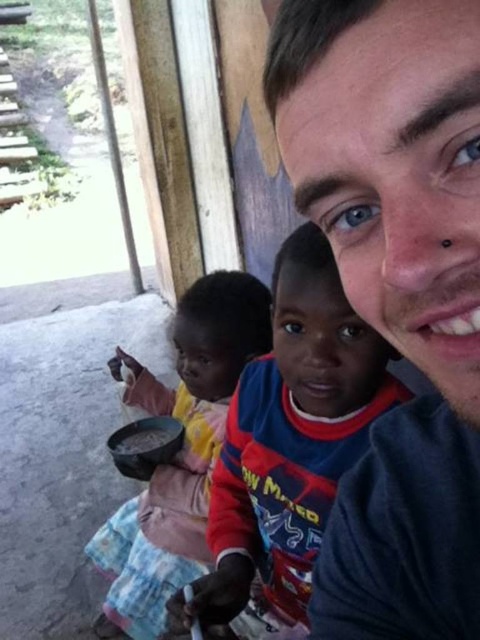
Which is behind, point (379, 474) or point (253, 316)?

Point (253, 316)

Is smooth gray shirt at center smaller than matte plastic bowl at lower left?

Correct, smooth gray shirt at center occupies less space than matte plastic bowl at lower left.

At what (x,y) coordinates should I click in order to perform the action: click on smooth gray shirt at center. Please return your answer as a coordinate pair (x, y). Looking at the image, I should click on (396, 291).

Describe the element at coordinates (291, 436) in the screenshot. I see `reddish-brown fabric shirt at center` at that location.

Between reddish-brown fabric shirt at center and matte plastic bowl at lower left, which one is positioned lower?

Positioned lower is matte plastic bowl at lower left.

Locate an element on the screen. The width and height of the screenshot is (480, 640). reddish-brown fabric shirt at center is located at coordinates (291, 436).

The height and width of the screenshot is (640, 480). Identify the location of reddish-brown fabric shirt at center. (291, 436).

Is point (355, 586) closer to camera compared to point (382, 356)?

Yes, it is.

Is smooth gray shirt at center to the right of reddish-brown fabric shirt at center from the viewer's perspective?

Yes, smooth gray shirt at center is to the right of reddish-brown fabric shirt at center.

I want to click on smooth gray shirt at center, so click(396, 291).